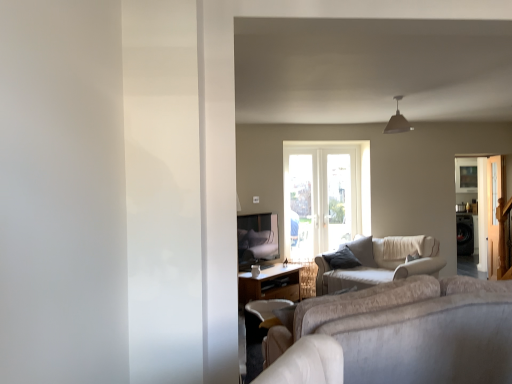
Describe the element at coordinates (381, 263) in the screenshot. I see `beige fabric couch at center` at that location.

Identify the location of dark brown leather swivel chair at lower center. The image size is (512, 384). (261, 315).

Describe the element at coordinates (494, 211) in the screenshot. I see `clear glass screen door at right, the first screen door when ordered from front to back` at that location.

I want to click on clear glass screen door at right, the second screen door from the back, so click(x=494, y=211).

Locate an element on the screen. metallic silver screen door at right, which appears as the 1th screen door when viewed from the back is located at coordinates (477, 201).

Locate an element on the screen. The image size is (512, 384). beige fabric couch at center is located at coordinates (381, 263).

Does wooden table at center turn towards metallic gray pendant light at upper center?

No, wooden table at center is not turned towards metallic gray pendant light at upper center.

Which object is closer to the camera, wooden table at center or metallic gray pendant light at upper center?

metallic gray pendant light at upper center is closer to the camera.

From the image's perspective, would you say wooden table at center is positioned over metallic gray pendant light at upper center?

No, from the image's perspective, wooden table at center is not on top of metallic gray pendant light at upper center.

Does point (481, 177) come behind point (490, 266)?

Yes, it is.

Between metallic silver screen door at right, which appears as the 1th screen door when viewed from the back, and clear glass screen door at right, the first screen door when ordered from front to back, which one has more height?

With more height is clear glass screen door at right, the first screen door when ordered from front to back.

Does metallic silver screen door at right, which appears as the 1th screen door when viewed from the back, have a smaller size compared to clear glass screen door at right, the first screen door when ordered from front to back?

Correct, metallic silver screen door at right, which appears as the 1th screen door when viewed from the back, occupies less space than clear glass screen door at right, the first screen door when ordered from front to back.

Based on the photo, how many degrees apart are the facing directions of beige fabric couch at center and metallic silver screen door at right, which appears as the 1th screen door when viewed from the back?

The facing directions of beige fabric couch at center and metallic silver screen door at right, which appears as the 1th screen door when viewed from the back, are 132 degrees apart.

Is beige fabric couch at center to the left of metallic silver screen door at right, which appears as the 1th screen door when viewed from the back, from the viewer's perspective?

Indeed, beige fabric couch at center is positioned on the left side of metallic silver screen door at right, which appears as the 1th screen door when viewed from the back.

Between beige fabric couch at center and metallic silver screen door at right, which is the 2th screen door in front-to-back order, which one is positioned behind?

metallic silver screen door at right, which is the 2th screen door in front-to-back order, is behind.

You are a GUI agent. You are given a task and a screenshot of the screen. Output one action in this format:
    pyautogui.click(x=<x>, y=<y>)
    Task: Click on the 2nd screen door behind the beige fabric couch at center
    
    Given the screenshot: What is the action you would take?
    pyautogui.click(x=477, y=201)

Is clear glass screen door at right, the first screen door when ordered from front to back, facing towards metallic gray pendant light at upper center?

No, clear glass screen door at right, the first screen door when ordered from front to back, does not turn towards metallic gray pendant light at upper center.

Does point (498, 155) appear closer or farther from the camera than point (399, 122)?

Point (498, 155).

Which of these two, clear glass screen door at right, the first screen door when ordered from front to back, or metallic gray pendant light at upper center, is wider?

With larger width is metallic gray pendant light at upper center.

How different are the orientations of clear glass screen door at right, the second screen door from the back, and metallic gray pendant light at upper center in degrees?

The angle between the facing direction of clear glass screen door at right, the second screen door from the back, and the facing direction of metallic gray pendant light at upper center is 94.8 degrees.

Is metallic silver screen door at right, which is the 2th screen door in front-to-back order, not close to metallic gray pendant light at upper center?

Yes, metallic silver screen door at right, which is the 2th screen door in front-to-back order, is far from metallic gray pendant light at upper center.

Considering the relative sizes of metallic silver screen door at right, which is the 2th screen door in front-to-back order, and metallic gray pendant light at upper center in the image provided, is metallic silver screen door at right, which is the 2th screen door in front-to-back order, shorter than metallic gray pendant light at upper center?

No.

Is metallic silver screen door at right, which is the 2th screen door in front-to-back order, situated inside metallic gray pendant light at upper center or outside?

metallic silver screen door at right, which is the 2th screen door in front-to-back order, is spatially situated outside metallic gray pendant light at upper center.

Visually, is metallic silver screen door at right, which appears as the 1th screen door when viewed from the back, positioned to the left or to the right of metallic gray pendant light at upper center?

In the image, metallic silver screen door at right, which appears as the 1th screen door when viewed from the back, appears on the right side of metallic gray pendant light at upper center.

Which is in front, metallic gray pendant light at upper center or dark brown leather swivel chair at lower center?

metallic gray pendant light at upper center is more forward.

Can you confirm if metallic gray pendant light at upper center is thinner than dark brown leather swivel chair at lower center?

Correct, the width of metallic gray pendant light at upper center is less than that of dark brown leather swivel chair at lower center.

From the image's perspective, which is above, metallic gray pendant light at upper center or dark brown leather swivel chair at lower center?

metallic gray pendant light at upper center, from the image's perspective.

Is metallic gray pendant light at upper center far from dark brown leather swivel chair at lower center?

That's right, there is a large distance between metallic gray pendant light at upper center and dark brown leather swivel chair at lower center.

From the image's perspective, which object appears higher, clear glass screen door at right, the second screen door from the back, or wooden table at center?

clear glass screen door at right, the second screen door from the back.

Could you tell me if clear glass screen door at right, the second screen door from the back, is turned towards wooden table at center?

No, clear glass screen door at right, the second screen door from the back, is not turned towards wooden table at center.

Relative to wooden table at center, is clear glass screen door at right, the second screen door from the back, in front or behind?

clear glass screen door at right, the second screen door from the back, is behind wooden table at center.

How many degrees apart are the facing directions of clear glass screen door at right, the second screen door from the back, and wooden table at center?

clear glass screen door at right, the second screen door from the back, and wooden table at center are facing 141 degrees away from each other.

Where is `table on the left of metallic gray pendant light at upper center`? The height and width of the screenshot is (384, 512). table on the left of metallic gray pendant light at upper center is located at coordinates (270, 284).

Locate an element on the screen. This screenshot has width=512, height=384. screen door on the right of metallic silver screen door at right, which appears as the 1th screen door when viewed from the back is located at coordinates (494, 211).

Looking at the image, which one is located further to metallic gray pendant light at upper center, dark brown leather swivel chair at lower center or metallic silver screen door at right, which is the 2th screen door in front-to-back order?

dark brown leather swivel chair at lower center is further to metallic gray pendant light at upper center.

From the image, which object appears to be nearer to metallic gray pendant light at upper center, beige fabric couch at center or metallic silver screen door at right, which is the 2th screen door in front-to-back order?

metallic silver screen door at right, which is the 2th screen door in front-to-back order.

Looking at the image, which one is located closer to dark brown leather swivel chair at lower center, metallic gray pendant light at upper center or beige fabric couch at center?

Among the two, beige fabric couch at center is located nearer to dark brown leather swivel chair at lower center.

Which object lies nearer to the anchor point clear glass screen door at right, the second screen door from the back, wooden table at center or beige fabric couch at center?

The object closer to clear glass screen door at right, the second screen door from the back, is beige fabric couch at center.

Looking at the image, which one is located closer to wooden table at center, metallic gray pendant light at upper center or clear glass screen door at right, the first screen door when ordered from front to back?

metallic gray pendant light at upper center lies closer to wooden table at center than the other object.

Based on their spatial positions, is beige fabric couch at center or dark brown leather swivel chair at lower center further from clear glass screen door at right, the first screen door when ordered from front to back?

Among the two, dark brown leather swivel chair at lower center is located further to clear glass screen door at right, the first screen door when ordered from front to back.

Which object lies further to the anchor point clear glass screen door at right, the first screen door when ordered from front to back, metallic silver screen door at right, which appears as the 1th screen door when viewed from the back, or dark brown leather swivel chair at lower center?

The object further to clear glass screen door at right, the first screen door when ordered from front to back, is dark brown leather swivel chair at lower center.

Looking at the image, which one is located further to dark brown leather swivel chair at lower center, wooden table at center or clear glass screen door at right, the first screen door when ordered from front to back?

The object further to dark brown leather swivel chair at lower center is clear glass screen door at right, the first screen door when ordered from front to back.

Identify the location of studio couch between wooden table at center and metallic silver screen door at right, which is the 2th screen door in front-to-back order. (381, 263).

At what (x,y) coordinates should I click in order to perform the action: click on studio couch between dark brown leather swivel chair at lower center and metallic silver screen door at right, which appears as the 1th screen door when viewed from the back, in the horizontal direction. Please return your answer as a coordinate pair (x, y). Looking at the image, I should click on (381, 263).

Find the location of a particular element. This screenshot has width=512, height=384. studio couch between dark brown leather swivel chair at lower center and clear glass screen door at right, the second screen door from the back, from left to right is located at coordinates (381, 263).

At what (x,y) coordinates should I click in order to perform the action: click on light fixture between wooden table at center and clear glass screen door at right, the second screen door from the back. Please return your answer as a coordinate pair (x, y). This screenshot has height=384, width=512. Looking at the image, I should click on (397, 121).